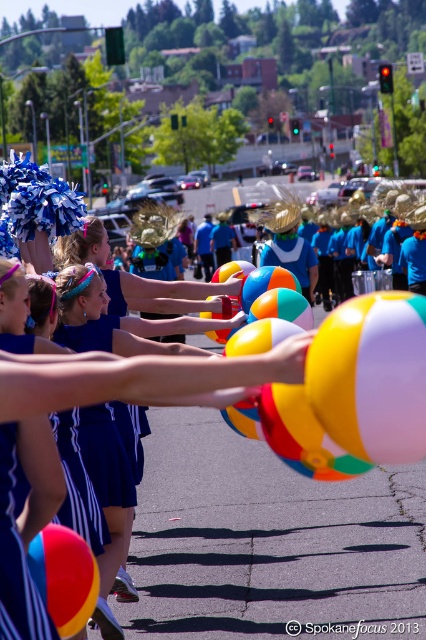
You are standing at the point labeled point (409, 371) and want to walk towards the point labeled point (57, 577). Given that both points are part of the same structure in the image, which direction should you face to move towards your destination?

Since point (409, 371) is closer to the camera than point (57, 577), you should face towards the lower right direction to move towards point (57, 577).

You are a photographer trying to capture a photo of the two points in the scene. Which point, point (423, 406) or point (132, 477), is positioned closer to the camera lens?

Point (423, 406) is closer to the camera than point (132, 477).

You are a photographer trying to capture the blue fabric uniform at center and the multicolored glossy beach ball at center in a single shot. Which object should you focus on first if you want to ensure both are in frame without moving the camera?

The blue fabric uniform at center is taller than the multicolored glossy beach ball at center, so you should focus on the blue fabric uniform at center first to ensure the entire height of both objects fits within the frame.